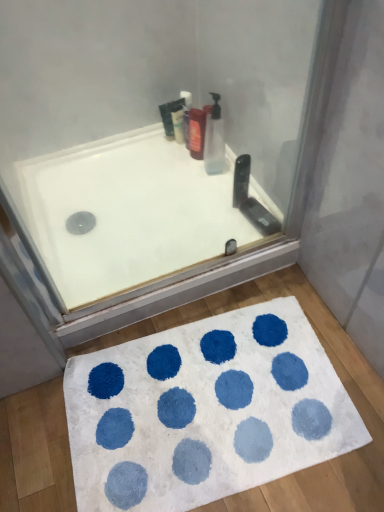
Image resolution: width=384 pixels, height=512 pixels. I want to click on vacant area to the left of translucent plastic bottle at upper center, which is the second cleaning product in left-to-right order, so click(x=166, y=163).